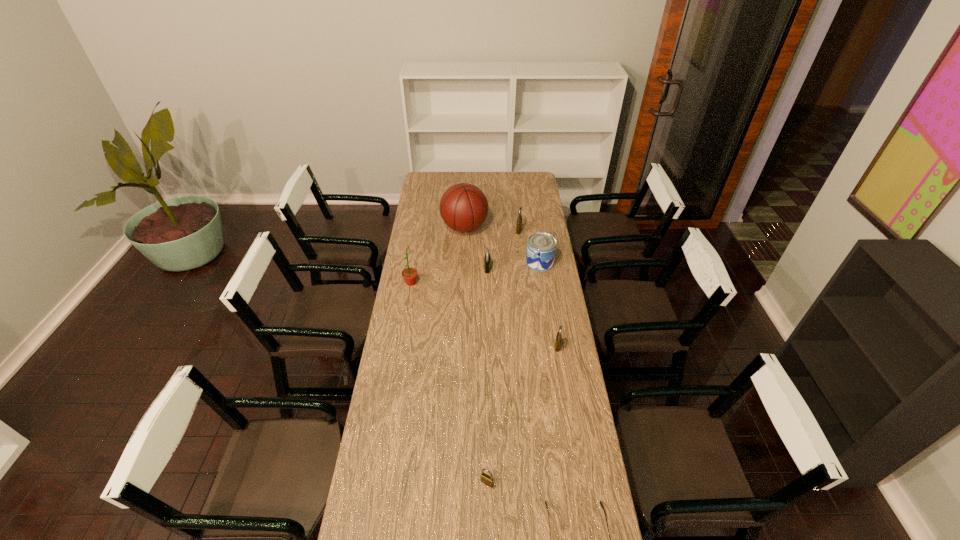
At what (x,y) coordinates should I click in order to perform the action: click on the smallest brass padlock. Please return your answer as a coordinate pair (x, y). The image size is (960, 540). Looking at the image, I should click on (488, 480).

At what (x,y) coordinates should I click in order to perform the action: click on vacant space located 0.160m on the back of the brown basketball. Please return your answer as a coordinate pair (x, y). This screenshot has width=960, height=540. Looking at the image, I should click on (466, 198).

You are a GUI agent. You are given a task and a screenshot of the screen. Output one action in this format:
    pyautogui.click(x=<x>, y=<y>)
    Task: Click on the vacant space located on the face of the sunflower
    This screenshot has width=960, height=540.
    Given the screenshot: What is the action you would take?
    pyautogui.click(x=446, y=283)

Identify the location of free space located 0.210m on the front of the farthest padlock. This screenshot has width=960, height=540. (522, 260).

This screenshot has height=540, width=960. What are the coordinates of `vacant space located on the front label of the blue can` in the screenshot? It's located at (446, 262).

Where is `free region located 0.090m on the front label of the blue can`? free region located 0.090m on the front label of the blue can is located at coordinates (508, 262).

This screenshot has width=960, height=540. I want to click on free location located on the front label of the blue can, so click(x=454, y=262).

This screenshot has width=960, height=540. What are the coordinates of `vacant space positioned on the front of the black padlock` in the screenshot? It's located at [x=489, y=320].

The height and width of the screenshot is (540, 960). I want to click on vacant space located 0.370m on the left of the rightmost padlock, so click(466, 346).

Identify the location of vacant region located 0.070m on the right of the nearest brass padlock. (515, 483).